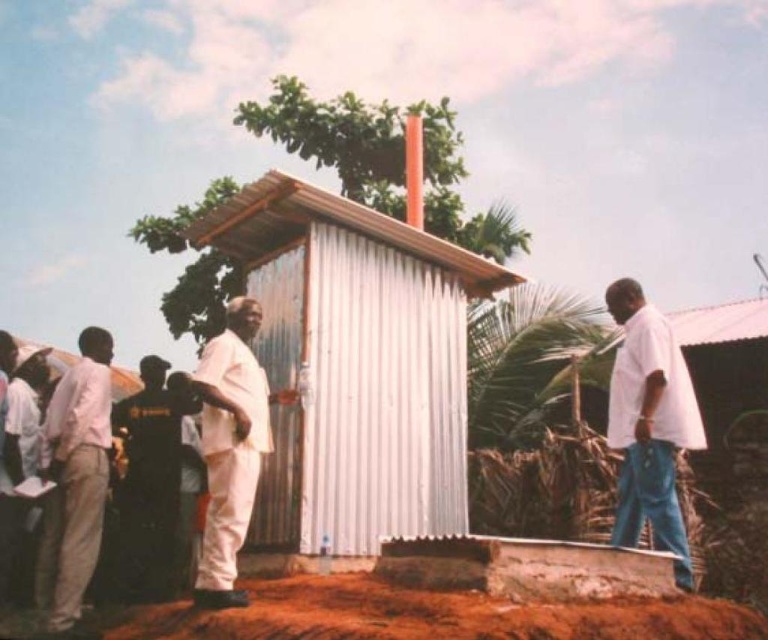
Question: Does light beige pants at left have a smaller size compared to white matte suit at center?

Choices:
 (A) yes
 (B) no

Answer: (A)

Question: Considering the relative positions of white cotton shirt at right and light beige pants at left in the image provided, where is white cotton shirt at right located with respect to light beige pants at left?

Choices:
 (A) right
 (B) left

Answer: (A)

Question: From the image, what is the correct spatial relationship of white corrugated metal hut at center in relation to white matte suit at center?

Choices:
 (A) left
 (B) right

Answer: (B)

Question: Which of the following is the farthest from the observer?

Choices:
 (A) (636, 456)
 (B) (353, 536)

Answer: (B)

Question: Which of the following is the farthest from the observer?

Choices:
 (A) white corrugated metal hut at center
 (B) white matte suit at center

Answer: (A)

Question: Estimate the real-world distances between objects in this image. Which object is closer to the white matte suit at center?

Choices:
 (A) light beige pants at left
 (B) white cotton shirt at right
 (C) white corrugated metal hut at center

Answer: (C)